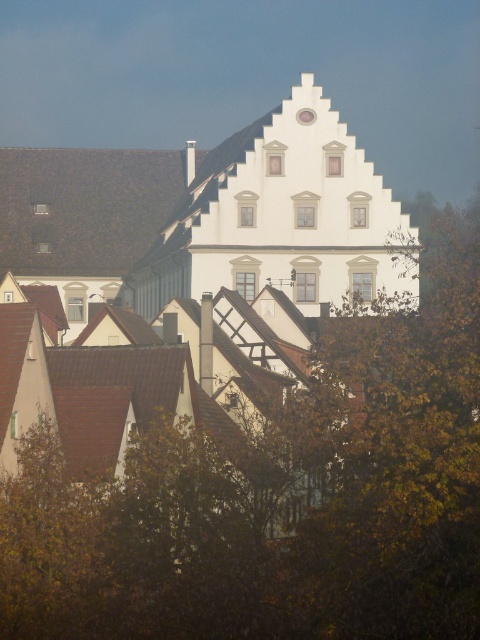
You are an architect analyzing the village layout. You notice the brown leafy tree at upper center and the white glossy clock at upper center. Which object occupies a wider space in the scene?

The brown leafy tree at upper center occupies a wider space in the scene than the white glossy clock at upper center because its width is larger.

You are standing in the village square looking at the central white building with the triangular roof. There are two points marked on the building. One is at coordinate point (x=265, y=502) and the other at point (x=311, y=109). Which point is closer to you?

Point (x=265, y=502) is closer to the viewer than point (x=311, y=109).